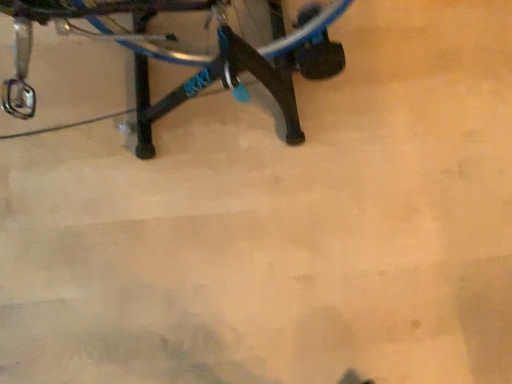
You are a GUI agent. You are given a task and a screenshot of the screen. Output one action in this format:
    pyautogui.click(x=<x>, y=<y>)
    Task: Click on the black matte bicycle at center
    This screenshot has height=384, width=512.
    Given the screenshot: What is the action you would take?
    pyautogui.click(x=184, y=54)

What do you see at coordinates (184, 54) in the screenshot?
I see `black matte bicycle at center` at bounding box center [184, 54].

Identify the location of black matte bicycle at center. The height and width of the screenshot is (384, 512). (184, 54).